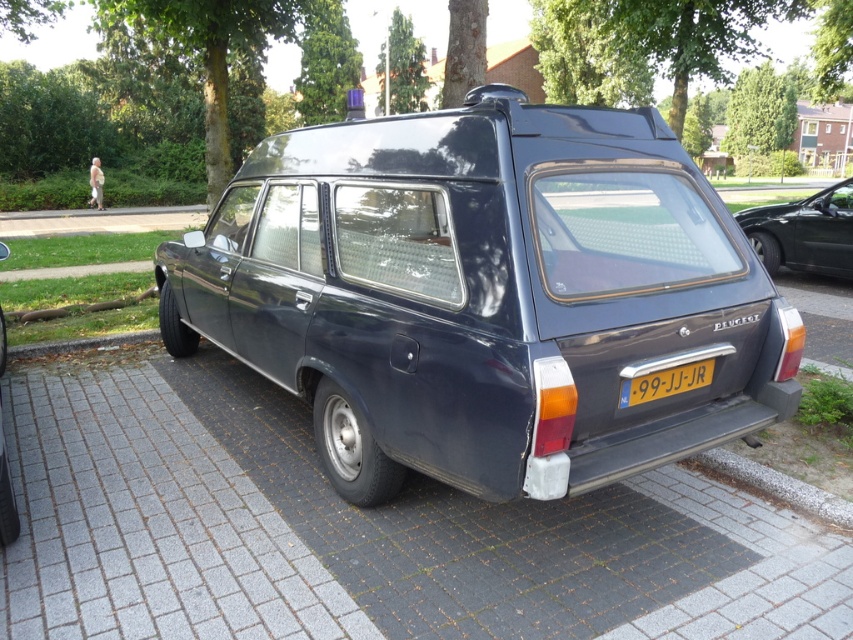
Does matte black minivan at center appear on the left side of yellow metallic license plate at center?

Yes, matte black minivan at center is to the left of yellow metallic license plate at center.

Does point (393, 116) lie behind point (698, 378)?

Yes, it is behind point (698, 378).

Locate an element on the screen. matte black minivan at center is located at coordinates (486, 296).

Can you confirm if gray concrete curb at lower right is wider than yellow metallic license plate at center?

Indeed, gray concrete curb at lower right has a greater width compared to yellow metallic license plate at center.

In order to click on gray concrete curb at lower right in this screenshot , I will do `click(776, 484)`.

Does point (697, 458) come behind point (625, 396)?

Yes.

Where is `gray concrete curb at lower right`? The image size is (853, 640). gray concrete curb at lower right is located at coordinates (776, 484).

Is point (512, 141) more distant than point (817, 225)?

That is False.

Where is `matte black minivan at center`? The height and width of the screenshot is (640, 853). matte black minivan at center is located at coordinates (486, 296).